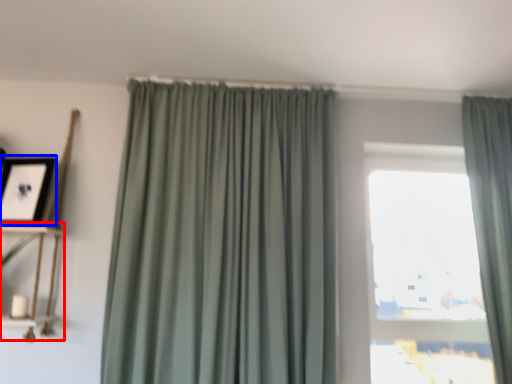
Question: Among these objects, which one is farthest to the camera, shelf (highlighted by a red box) or picture frame (highlighted by a blue box)?

Choices:
 (A) shelf
 (B) picture frame

Answer: (B)